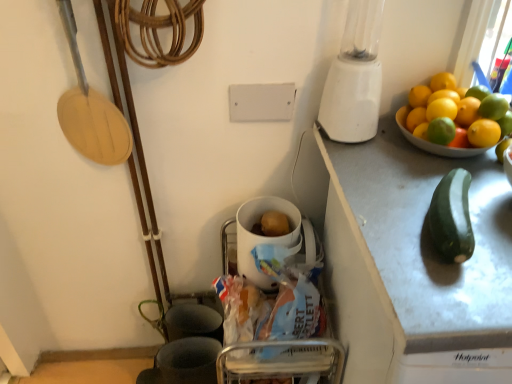
Locate an element on the screen. This screenshot has height=384, width=512. free region on the left part of yellow matte lemon at upper right, the fourth lemon when ordered from top to bottom is located at coordinates (373, 155).